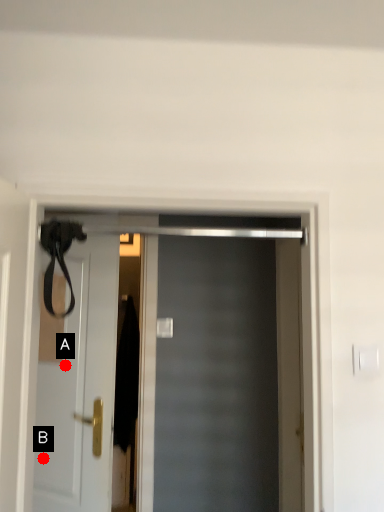
Question: Two points are circled on the image, labeled by A and B beside each circle. Which point appears closest to the camera in this image?

Choices:
 (A) A is closer
 (B) B is closer

Answer: (B)